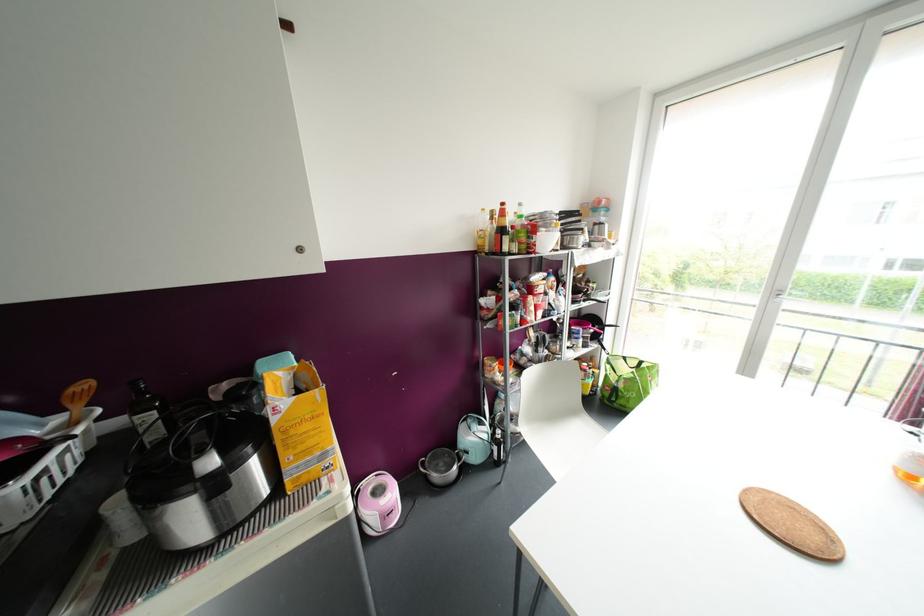
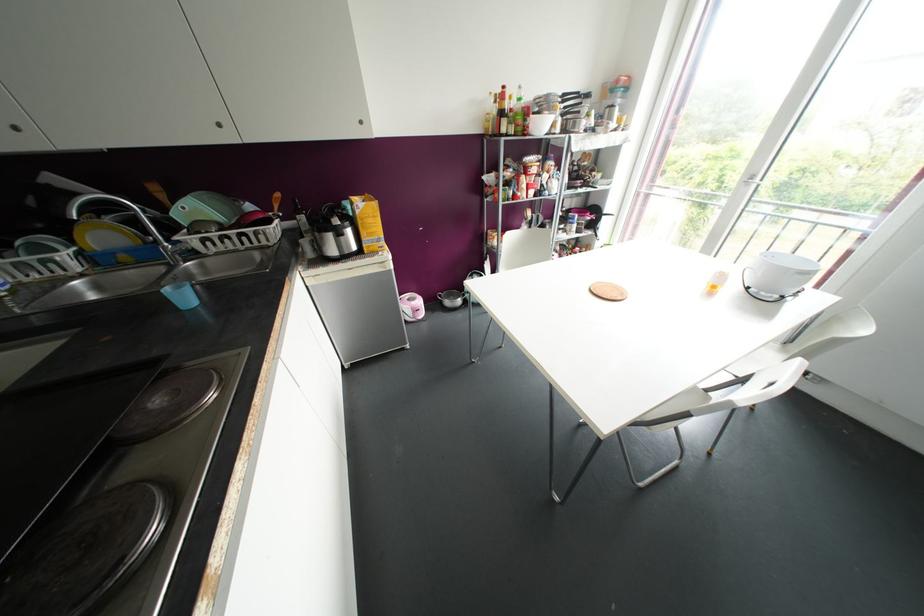
Where in the second image is the point corresponding to pixel 299 249 from the first image?

(360, 122)